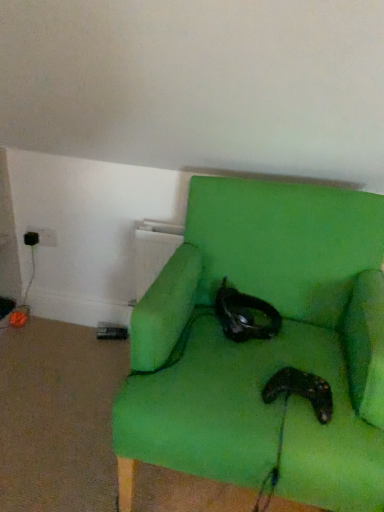
Question: From the image's perspective, is black matte cat at center below black matte controller at lower center?

Choices:
 (A) yes
 (B) no

Answer: (B)

Question: Is black matte cat at center closer to the viewer compared to black matte controller at lower center?

Choices:
 (A) yes
 (B) no

Answer: (B)

Question: Is black matte cat at center at the left side of black matte controller at lower center?

Choices:
 (A) no
 (B) yes

Answer: (B)

Question: Can black matte controller at lower center be found inside black matte cat at center?

Choices:
 (A) yes
 (B) no

Answer: (B)

Question: Does black matte cat at center have a lesser height compared to black matte controller at lower center?

Choices:
 (A) no
 (B) yes

Answer: (A)

Question: In terms of height, does black matte cat at center look taller or shorter compared to green fabric chair at center?

Choices:
 (A) tall
 (B) short

Answer: (B)

Question: Do you think black matte cat at center is within green fabric chair at center, or outside of it?

Choices:
 (A) inside
 (B) outside

Answer: (A)

Question: From the image's perspective, is black matte cat at center positioned above or below green fabric chair at center?

Choices:
 (A) above
 (B) below

Answer: (A)

Question: Is black matte cat at center wider or thinner than green fabric chair at center?

Choices:
 (A) wide
 (B) thin

Answer: (B)

Question: From a real-world perspective, is green fabric chair at center positioned above or below black matte controller at lower center?

Choices:
 (A) above
 (B) below

Answer: (B)

Question: From the image's perspective, relative to black matte controller at lower center, is green fabric chair at center above or below?

Choices:
 (A) above
 (B) below

Answer: (A)

Question: Considering the positions of green fabric chair at center and black matte controller at lower center in the image, is green fabric chair at center taller or shorter than black matte controller at lower center?

Choices:
 (A) short
 (B) tall

Answer: (B)

Question: Looking at the image, does green fabric chair at center seem bigger or smaller compared to black matte controller at lower center?

Choices:
 (A) big
 (B) small

Answer: (A)

Question: Based on their positions, is black matte controller at lower center located to the left or right of black matte cat at center?

Choices:
 (A) left
 (B) right

Answer: (B)

Question: Considering their positions, is black matte controller at lower center located in front of or behind black matte cat at center?

Choices:
 (A) front
 (B) behind

Answer: (A)